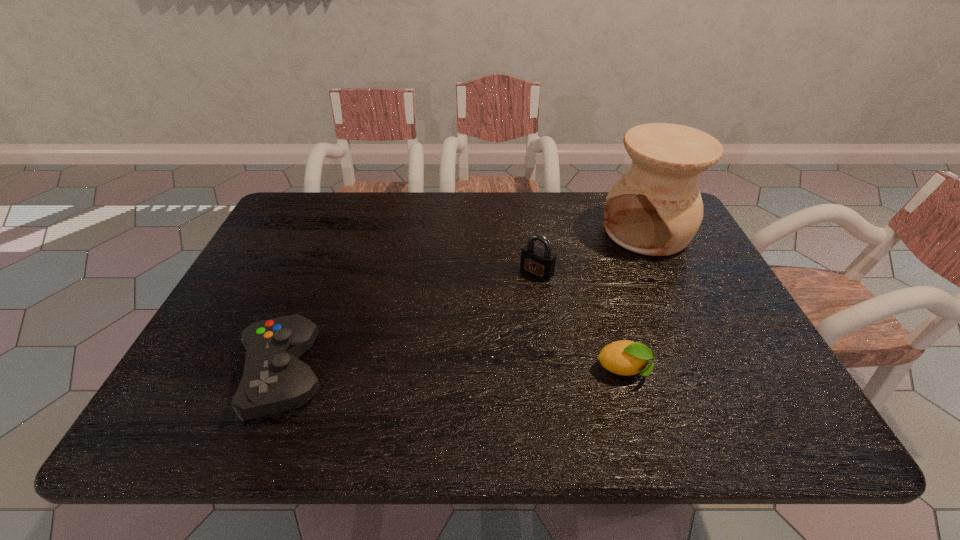
The height and width of the screenshot is (540, 960). In order to click on vacant space located 0.160m on the front of the third shortest object near the keyhole in this screenshot , I will do `click(495, 317)`.

Image resolution: width=960 pixels, height=540 pixels. In order to click on free space located 0.370m at the open side of the tallest object in this screenshot , I will do `click(539, 322)`.

In order to click on free region located at the open side of the tallest object in this screenshot , I will do `click(584, 285)`.

Where is `blank area located 0.270m at the open side of the tallest object`? This screenshot has width=960, height=540. blank area located 0.270m at the open side of the tallest object is located at coordinates (564, 301).

You are a GUI agent. You are given a task and a screenshot of the screen. Output one action in this format:
    pyautogui.click(x=<x>, y=<y>)
    Task: Click on the object that is at the far edge
    The width and height of the screenshot is (960, 540).
    Given the screenshot: What is the action you would take?
    pyautogui.click(x=655, y=208)

You are a GUI agent. You are given a task and a screenshot of the screen. Output one action in this format:
    pyautogui.click(x=<x>, y=<y>)
    Task: Click on the control located at the near edge
    The image size is (960, 540).
    Given the screenshot: What is the action you would take?
    pyautogui.click(x=274, y=380)

Where is `lemon present at the near edge`? The height and width of the screenshot is (540, 960). lemon present at the near edge is located at coordinates (624, 357).

Locate an element on the screen. object situated at the left edge is located at coordinates (274, 380).

I want to click on object located in the right edge section of the desktop, so click(655, 208).

You are a GUI agent. You are given a task and a screenshot of the screen. Output one action in this format:
    pyautogui.click(x=<x>, y=<y>)
    Task: Click on the object that is at the near left corner
    This screenshot has width=960, height=540.
    Given the screenshot: What is the action you would take?
    pyautogui.click(x=274, y=380)